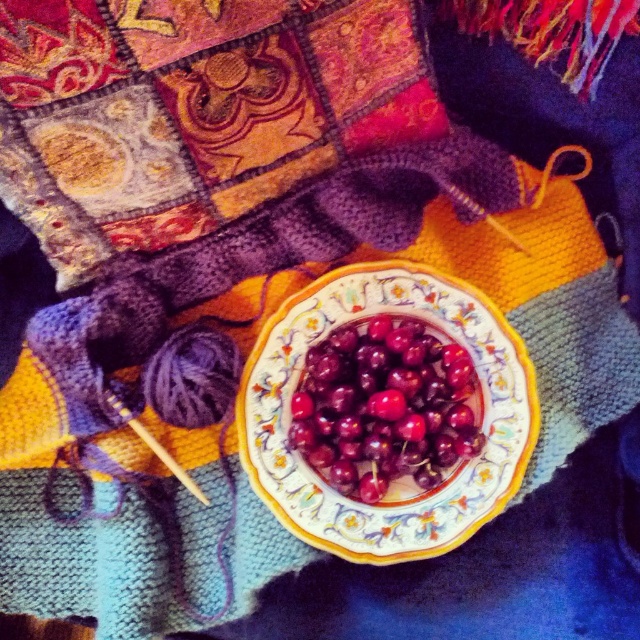
You are a chef preparing a dessert and need to place a garnish on the porcelain plate at center. The shiny red cherries at center are nearby. Can you easily reach the cherries from the plate without moving either item?

The porcelain plate at center is further to the viewer than shiny red cherries at center, so the cherries are closer to you. Therefore, you can easily reach the shiny red cherries at center from the porcelain plate at center without moving either item.

You are arranging a fruit platter and have a porcelain plate at center and shiny red cherries at center. If you want to place the cherries on the plate, will the cherries fit on the plate?

The porcelain plate at center might be wider than shiny red cherries at center, so there is a possibility that the cherries will fit on the plate. However, the exact dimensions are uncertain based on the provided information.

You are arranging a table for a party and need to place a porcelain plate at center. According to the image, where should you position it relative to the bowl of cherries?

The porcelain plate at center is located at point (x=404, y=484), so position it at those coordinates relative to the bowl of cherries.